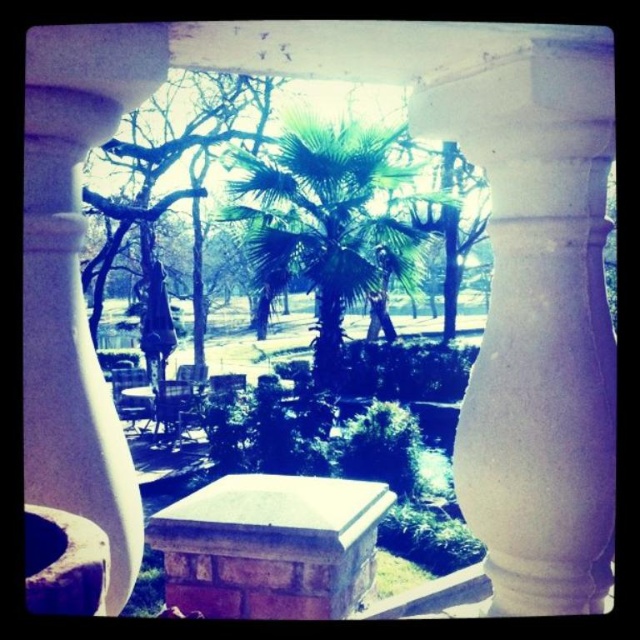
Describe the element at coordinates (538, 321) in the screenshot. I see `white smooth pillar at center` at that location.

Who is more forward, (570, 164) or (328, 358)?

Point (570, 164)

Image resolution: width=640 pixels, height=640 pixels. Find the location of `white smooth pillar at center`. white smooth pillar at center is located at coordinates (538, 321).

This screenshot has width=640, height=640. I want to click on white smooth pillar at center, so click(538, 321).

Is white stone pillar at center bigger than green leafy palm tree at center?

Incorrect, white stone pillar at center is not larger than green leafy palm tree at center.

Which of these two, white stone pillar at center or green leafy palm tree at center, stands taller?

Standing taller between the two is green leafy palm tree at center.

Where is `white stone pillar at center`? Image resolution: width=640 pixels, height=640 pixels. white stone pillar at center is located at coordinates (76, 280).

Is point (506, 408) positioned in front of point (216, 80)?

Yes, it is.

Can you confirm if white smooth pillar at center is positioned below green leafy tree at center?

Yes.

Is point (529, 253) positioned in front of point (150, 248)?

Yes, point (529, 253) is closer to viewer.

Identify the location of white smooth pillar at center. (538, 321).